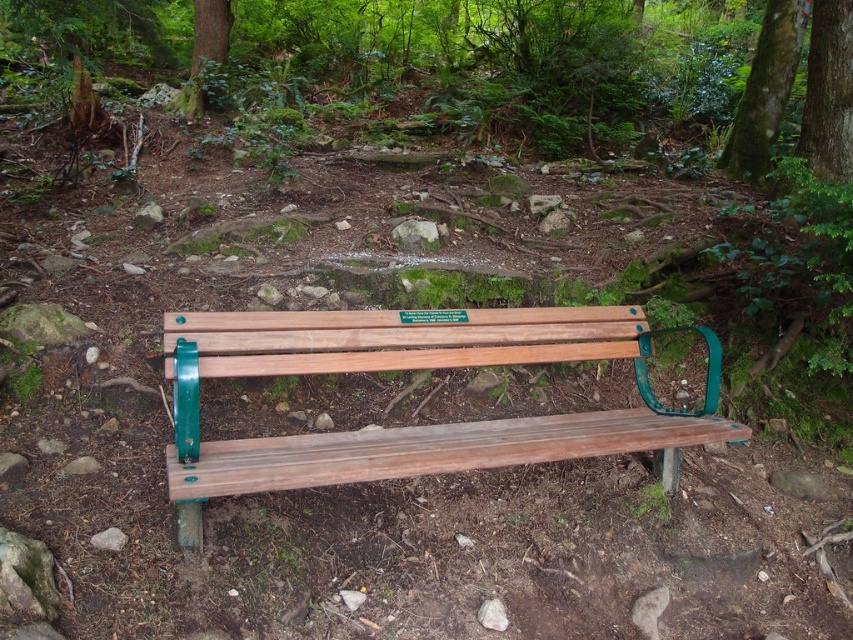
Looking at this image, you are a hiker who wants to sit on the wooden bench at center. Considering the green textured bark at upper right is nearby, will the bench be tall enough to allow you to comfortably rest your arms on the green metal armrests?

The wooden bench at center is shorter than the green textured bark at upper right. However, the height of the bench itself is not directly compared to the hiker, so we cannot determine if it will be tall enough for comfortable armrest access.

Based on the photo, you are a hiker who wants to take a break on the wooden bench at center. Based on the scene, will the green textured tree trunk at upper center block your view of the sky when sitting on the bench?

→ The wooden bench at center is below the green textured tree trunk at upper center, so the tree trunk will block part of the sky view when sitting on the bench.

You are a hiker who wants to take a break on the wooden bench at center. However, you notice a green textured tree trunk at upper center nearby. Which direction should you walk to move from the tree trunk to the bench?

You should walk to the right to move from the green textured tree trunk at upper center to the wooden bench at center since the wooden bench at center is to the right of the green textured tree trunk at upper center.